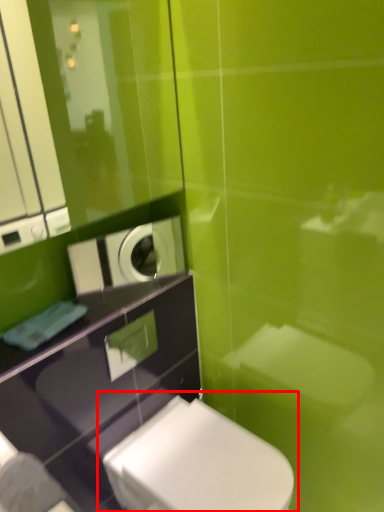
Question: Where is toilet (annotated by the red box) located in relation to appliance in the image?

Choices:
 (A) left
 (B) right

Answer: (B)